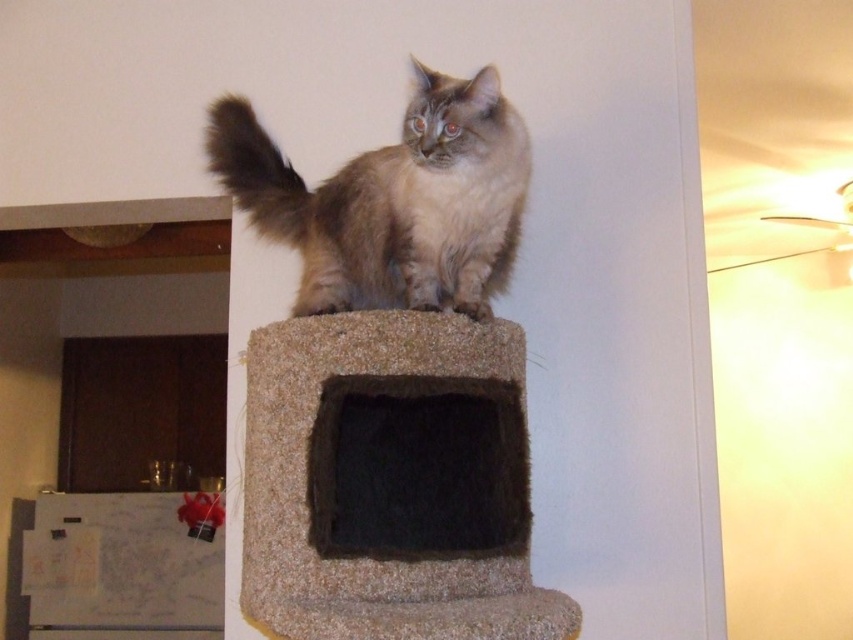
Which of these two, fuzzy beige cat at center or fuzzy brown tail at upper center, stands taller?

With more height is fuzzy beige cat at center.

Looking at this image, is the position of fuzzy beige cat at center less distant than that of fuzzy brown tail at upper center?

Yes, fuzzy beige cat at center is closer to the viewer.

Locate an element on the screen. This screenshot has height=640, width=853. fuzzy beige cat at center is located at coordinates (392, 200).

The width and height of the screenshot is (853, 640). I want to click on fuzzy beige cat at center, so click(392, 200).